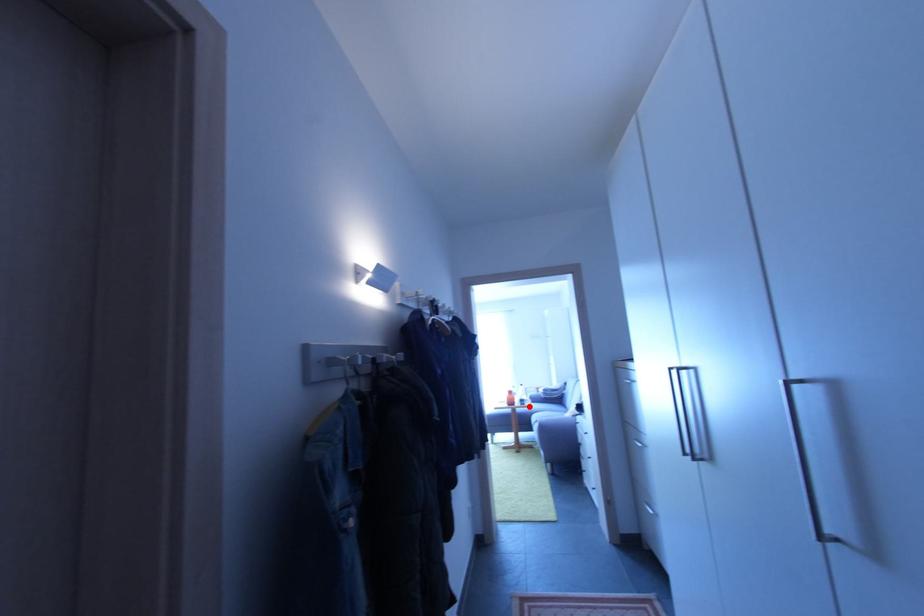
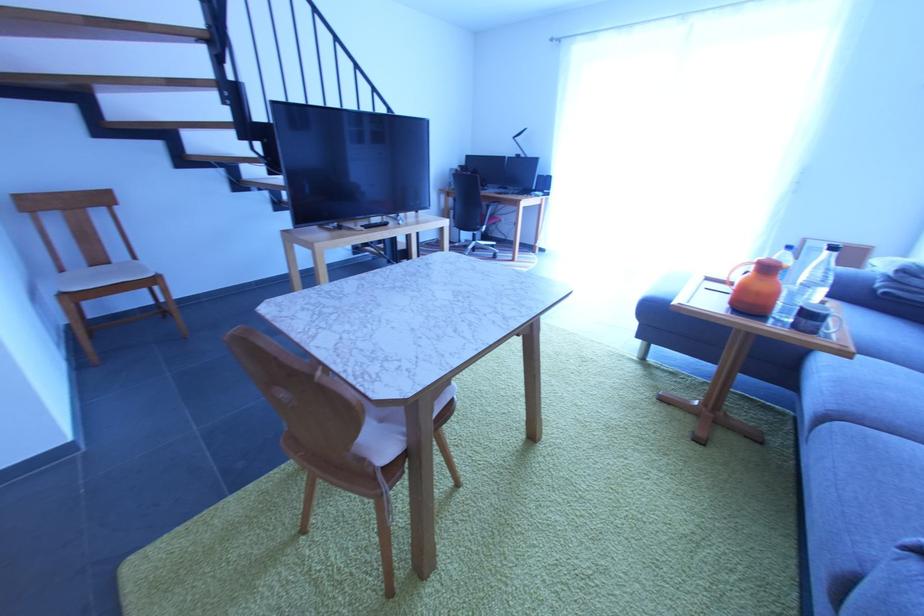
In the second image, find the point that corresponds to the highlighted location in the first image.

(819, 334)